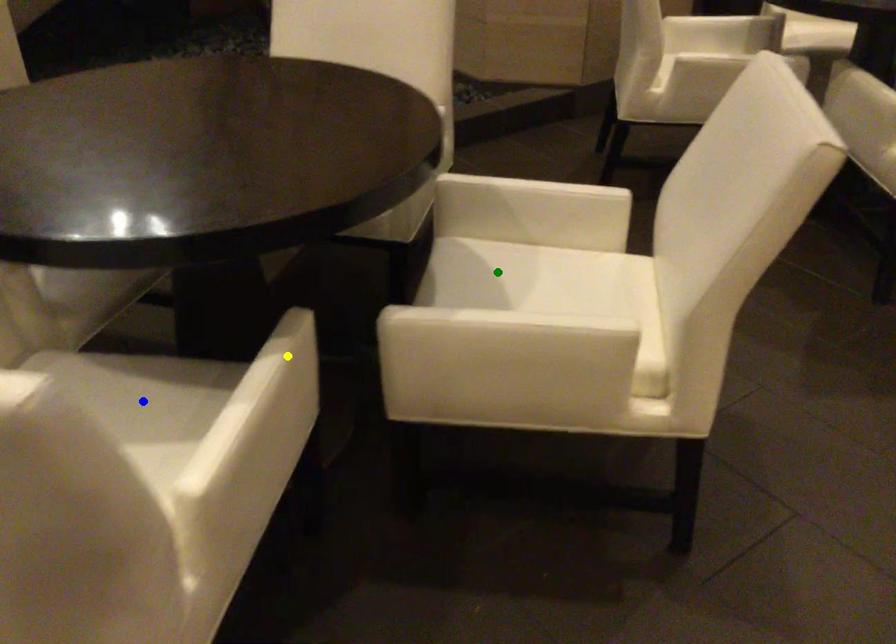
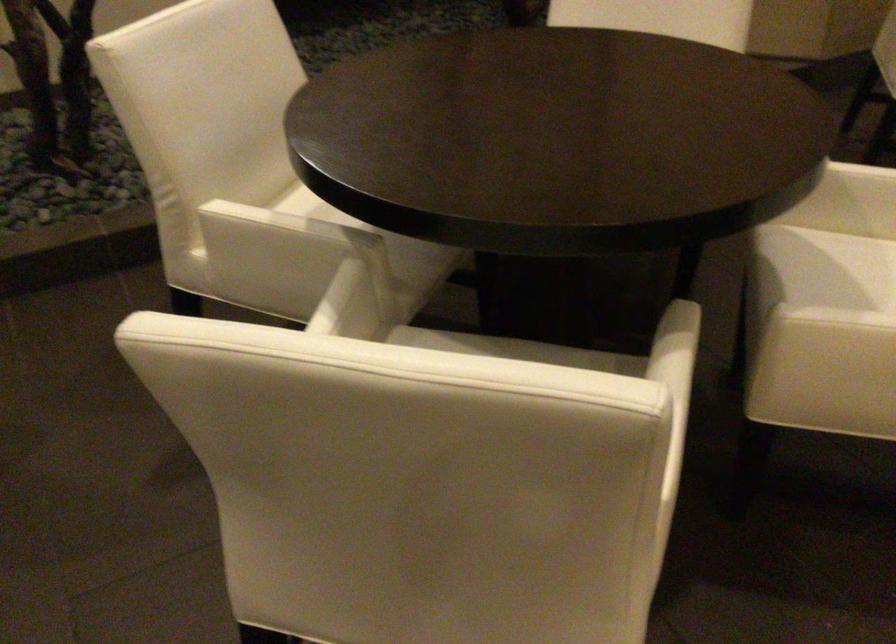
I am providing you with two images of the same scene from different viewpoints. Three points are marked in image1. Which point corresponds to a part or object that is occluded in image2?In image1, three points are marked. Which of them correspond to a part or object that is occluded in image2?Among the three points shown in image1, which one corresponds to a part or object that is no longer visible due to occlusion in image2?

blue point